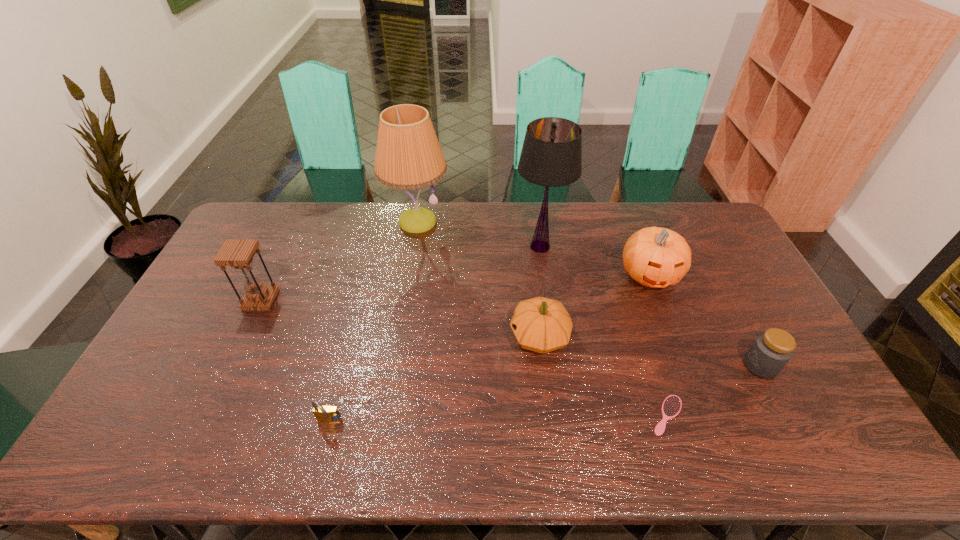
I want to click on free region located 0.280m on the front-facing side of the lampshade, so click(435, 247).

The width and height of the screenshot is (960, 540). In order to click on free space located 0.160m on the front-facing side of the lampshade in this screenshot , I will do `click(468, 247)`.

Locate an element on the screen. This screenshot has width=960, height=540. free space located on the side of the lamp near the pull switch is located at coordinates (411, 261).

Where is `vacant area situated on the right of the hourglass`? This screenshot has height=540, width=960. vacant area situated on the right of the hourglass is located at coordinates [397, 300].

Locate an element on the screen. This screenshot has width=960, height=540. vacant point located 0.120m on the front-facing side of the pumpkin is located at coordinates point(669,327).

The height and width of the screenshot is (540, 960). I want to click on vacant space positioned on the side of the gourd with the carved face, so click(391, 336).

This screenshot has width=960, height=540. I want to click on blank space located 0.190m on the side of the gourd with the carved face, so click(444, 336).

At what (x,y) coordinates should I click in order to perform the action: click on vacant space located 0.400m on the side of the gourd with the carved face. Please return your answer as a coordinate pair (x, y). The height and width of the screenshot is (540, 960). Looking at the image, I should click on (x=373, y=336).

The width and height of the screenshot is (960, 540). I want to click on vacant region located on the surface of the rightmost object near the warning symbol, so click(x=694, y=366).

At what (x,y) coordinates should I click in order to perform the action: click on blank space located 0.320m on the surface of the rightmost object near the warning symbol. Please return your answer as a coordinate pair (x, y). Looking at the image, I should click on (630, 366).